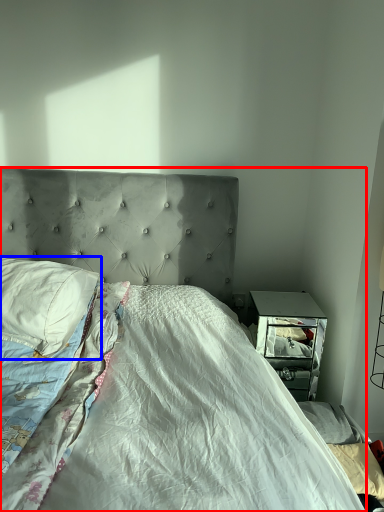
Question: Which point is further to the camera, bed (highlighted by a red box) or pillow (highlighted by a blue box)?

Choices:
 (A) bed
 (B) pillow

Answer: (B)